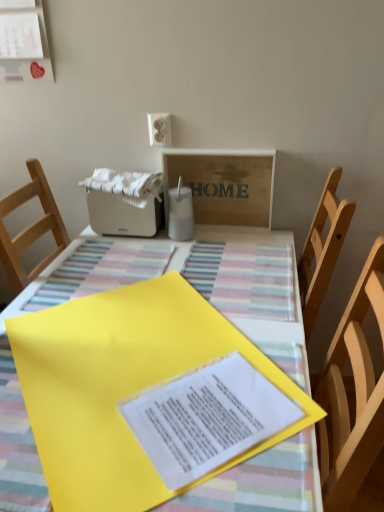
You are a GUI agent. You are given a task and a screenshot of the screen. Output one action in this format:
    pyautogui.click(x=<x>, y=<y>)
    Task: Click on the free space above wooden signboard at upper center (from a real-world perspective)
    The height and width of the screenshot is (512, 384).
    Given the screenshot: What is the action you would take?
    pyautogui.click(x=221, y=147)